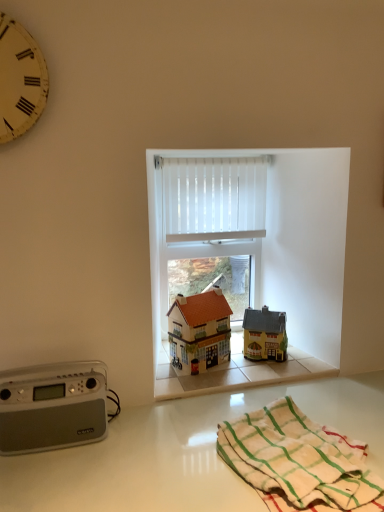
Question: Can you confirm if white vertical blinds at center is taller than yellow painted wood clock at upper left?

Choices:
 (A) yes
 (B) no

Answer: (A)

Question: Is white vertical blinds at center shorter than yellow painted wood clock at upper left?

Choices:
 (A) yes
 (B) no

Answer: (B)

Question: Is the position of white vertical blinds at center more distant than that of yellow painted wood clock at upper left?

Choices:
 (A) no
 (B) yes

Answer: (B)

Question: From the image's perspective, is white vertical blinds at center beneath yellow painted wood clock at upper left?

Choices:
 (A) yes
 (B) no

Answer: (A)

Question: Can you confirm if white vertical blinds at center is positioned to the right of yellow painted wood clock at upper left?

Choices:
 (A) no
 (B) yes

Answer: (B)

Question: Can you see white vertical blinds at center touching yellow painted wood clock at upper left?

Choices:
 (A) yes
 (B) no

Answer: (B)

Question: Can you confirm if yellow painted wood clock at upper left is wider than matte orange roofed house at center, the 2th toy in the right-to-left sequence?

Choices:
 (A) yes
 (B) no

Answer: (B)

Question: Considering the relative sizes of yellow painted wood clock at upper left and matte orange roofed house at center, the first toy in the left-to-right sequence, in the image provided, is yellow painted wood clock at upper left smaller than matte orange roofed house at center, the first toy in the left-to-right sequence,?

Choices:
 (A) no
 (B) yes

Answer: (B)

Question: Does yellow painted wood clock at upper left have a lesser width compared to matte orange roofed house at center, the 2th toy in the right-to-left sequence?

Choices:
 (A) yes
 (B) no

Answer: (A)

Question: Does yellow painted wood clock at upper left have a greater height compared to matte orange roofed house at center, the 2th toy in the right-to-left sequence?

Choices:
 (A) no
 (B) yes

Answer: (B)

Question: Is yellow painted wood clock at upper left bigger than matte orange roofed house at center, the 2th toy in the right-to-left sequence?

Choices:
 (A) yes
 (B) no

Answer: (B)

Question: Can we say yellow painted wood clock at upper left lies outside matte orange roofed house at center, the 2th toy in the right-to-left sequence?

Choices:
 (A) no
 (B) yes

Answer: (B)

Question: Is matte orange roofed house at center, the first toy in the left-to-right sequence, at the back of white glossy countertop at lower center?

Choices:
 (A) yes
 (B) no

Answer: (B)